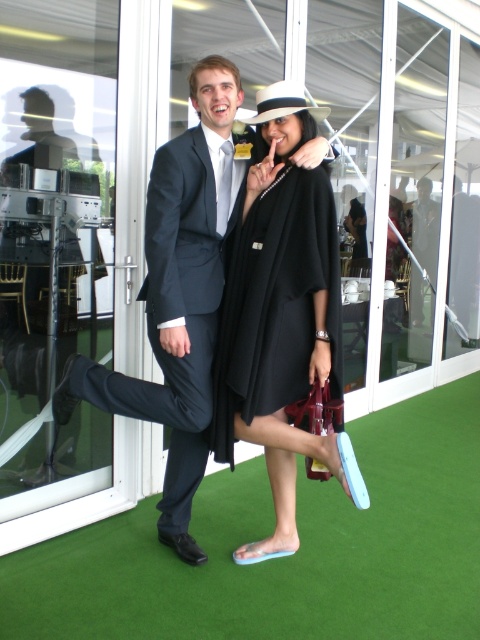
Consider the image. Who is positioned more to the right, matte black suit at center or black matte dress at center?

From the viewer's perspective, black matte dress at center appears more on the right side.

Describe the element at coordinates (179, 296) in the screenshot. The height and width of the screenshot is (640, 480). I see `matte black suit at center` at that location.

Who is more forward, (191, 496) or (274, 292)?

Point (274, 292)

Identify the location of matte black suit at center. (179, 296).

Is black matte coat at center to the left of black matte dress at center from the viewer's perspective?

In fact, black matte coat at center is to the right of black matte dress at center.

Is black matte coat at center smaller than black matte dress at center?

No.

Between point (302, 182) and point (240, 376), which one is positioned behind?

The point (240, 376) is more distant.

Find the location of a particular element. black matte coat at center is located at coordinates (283, 317).

Is point (135, 417) closer to viewer compared to point (256, 275)?

That is False.

Which is behind, point (181, 272) or point (284, 225)?

Point (181, 272)

Who is more forward, (193, 273) or (303, 296)?

Positioned in front is point (303, 296).

This screenshot has width=480, height=640. I want to click on dark blue wool suit at center, so click(171, 317).